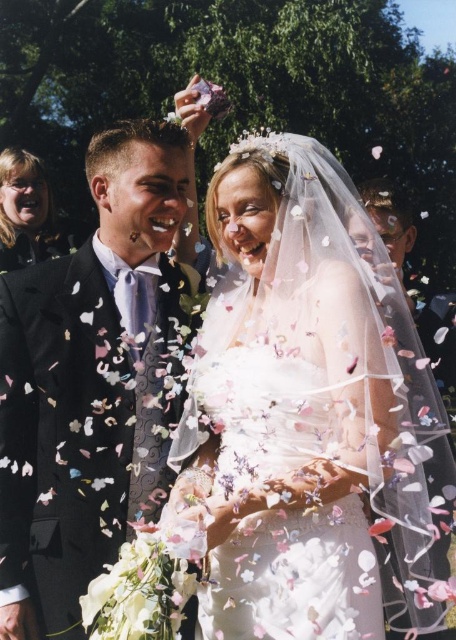
Question: Which object is positioned farthest from the matte black jacket at upper left?

Choices:
 (A) black satin suit at left
 (B) white satin dress at center

Answer: (B)

Question: Does white satin dress at center appear over black satin suit at left?

Choices:
 (A) yes
 (B) no

Answer: (B)

Question: Is the position of white satin dress at center more distant than that of black satin suit at left?

Choices:
 (A) no
 (B) yes

Answer: (A)

Question: Is the position of black satin suit at left less distant than that of matte black jacket at upper left?

Choices:
 (A) no
 (B) yes

Answer: (B)

Question: Which of the following is the farthest from the observer?

Choices:
 (A) (324, 170)
 (B) (77, 611)
 (C) (21, 180)

Answer: (C)

Question: Estimate the real-world distances between objects in this image. Which object is closer to the black satin suit at left?

Choices:
 (A) white satin dress at center
 (B) matte black jacket at upper left

Answer: (A)